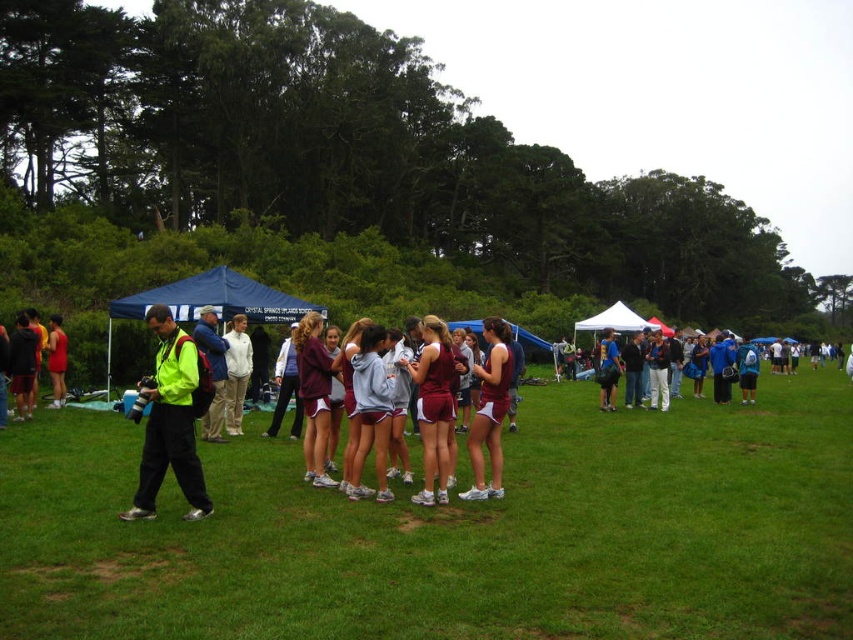
Question: Which of these objects is positioned farthest from the green grass at center?

Choices:
 (A) neon yellow jacket at left
 (B) matte green jacket at left
 (C) white cotton hoodie at center
 (D) maroon jersey at center

Answer: (B)

Question: From the image, what is the correct spatial relationship of maroon jersey at center in relation to white cotton hoodie at center?

Choices:
 (A) right
 (B) left

Answer: (A)

Question: Which point appears farthest from the camera in this image?

Choices:
 (A) (485, 403)
 (B) (56, 356)
 (C) (817, 438)

Answer: (B)

Question: Among these objects, which one is farthest from the camera?

Choices:
 (A) maroon jersey at center
 (B) white cotton hoodie at center
 (C) neon yellow jacket at left

Answer: (B)

Question: Can you confirm if neon yellow jacket at left is smaller than matte green jacket at left?

Choices:
 (A) yes
 (B) no

Answer: (B)

Question: Does maroon jersey at center appear over matte green jacket at left?

Choices:
 (A) yes
 (B) no

Answer: (B)